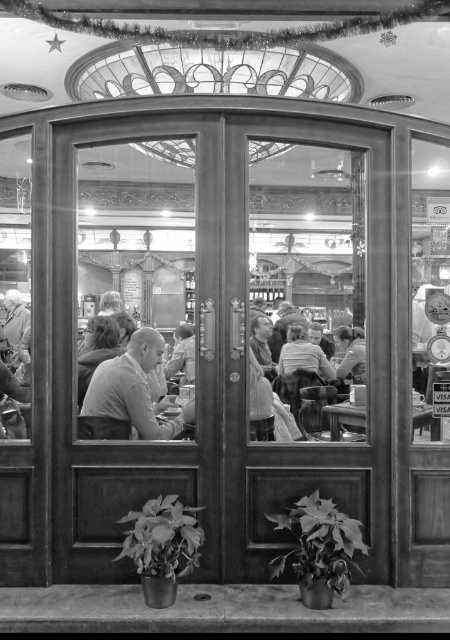
You are standing at the entrance of the cafe looking through the ornate wooden door. There is a point marked at coordinates (351, 353). What object or person is located at this point?

The point at coordinates (351, 353) corresponds to the smooth skin person at center.

You are a customer entering the cozy cafe through the ornate wooden door. You see a smooth fabric shirt at center and a smooth wooden table at center. Which object is higher in height?

The smooth fabric shirt at center is taller than the smooth wooden table at center.

You are a customer entering the cozy cafe through the ornate wooden door. You notice a smooth skin person at center and a smooth beige shirt at center. Which one is smaller in size?

The smooth skin person at center is smaller in size compared to the smooth beige shirt at center.